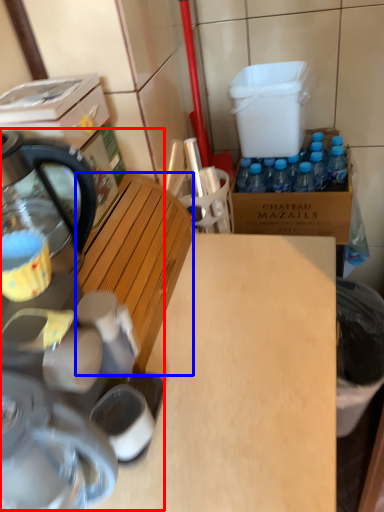
Question: Which object is closer to the camera taking this photo, coffee machine (highlighted by a red box) or wood (highlighted by a blue box)?

Choices:
 (A) coffee machine
 (B) wood

Answer: (A)